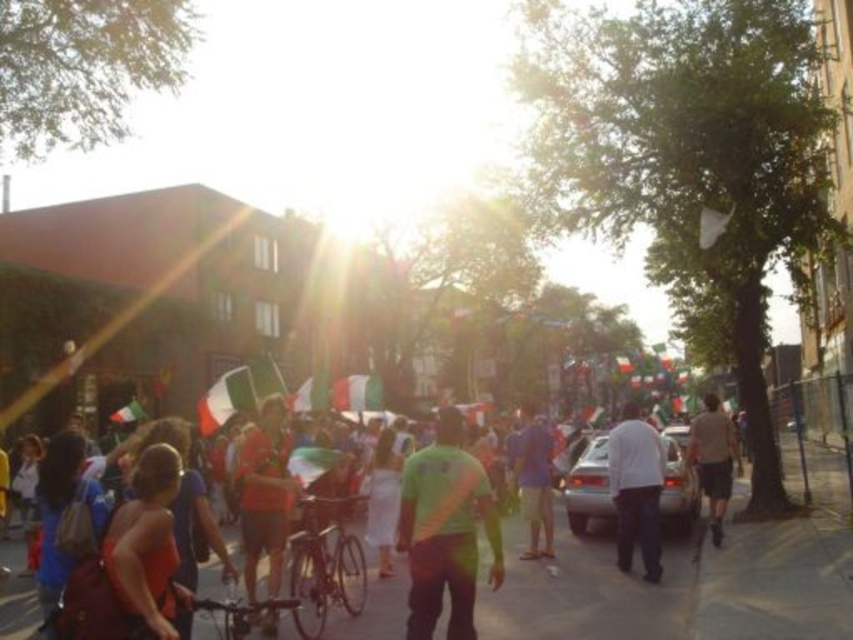
You are a photographer trying to capture a photo of the blue cotton shirt at center and the gray concrete sidewalk at center. Which object is shorter in height?

The gray concrete sidewalk at center is shorter than the blue cotton shirt at center.

You are a photographer trying to capture a clear shot of the white matte shirt at center and the light brown shorts at center. Since the sun is causing glare, where should you position yourself relative to the subjects to avoid the bright light?

To avoid the glare from the sun, position yourself so that the subjects are between you and the sun. Since the white matte shirt at center is thinner than the light brown shorts at center, the shirt will block some of the sunlight, reducing glare on the shorts.